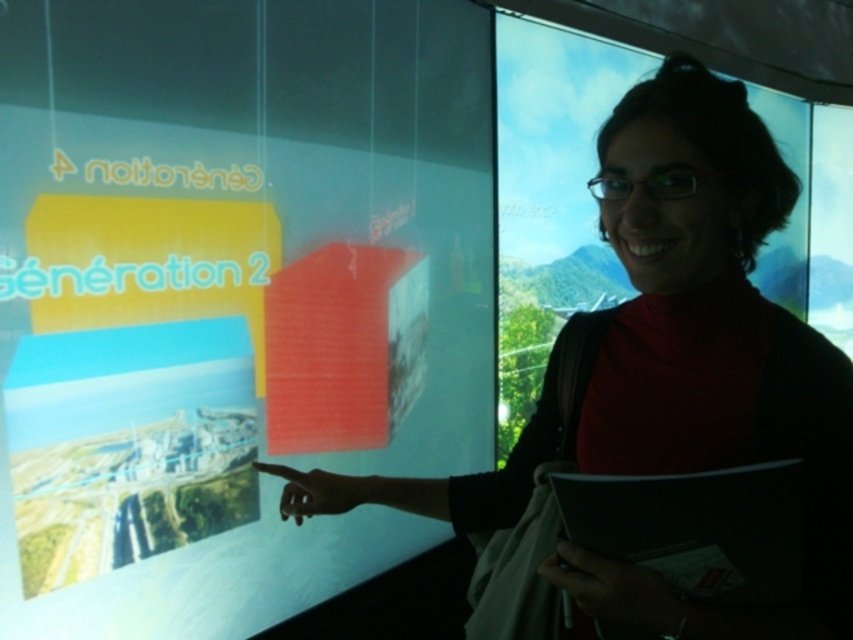
Is matte plastic screen at center below matte black sweater at center?

No, matte plastic screen at center is not below matte black sweater at center.

How much distance is there between matte plastic screen at center and matte black sweater at center?

76.89 centimeters

Which is behind, point (57, 124) or point (758, 128)?

Positioned behind is point (57, 124).

In order to click on matte plastic screen at center in this screenshot , I will do `click(231, 298)`.